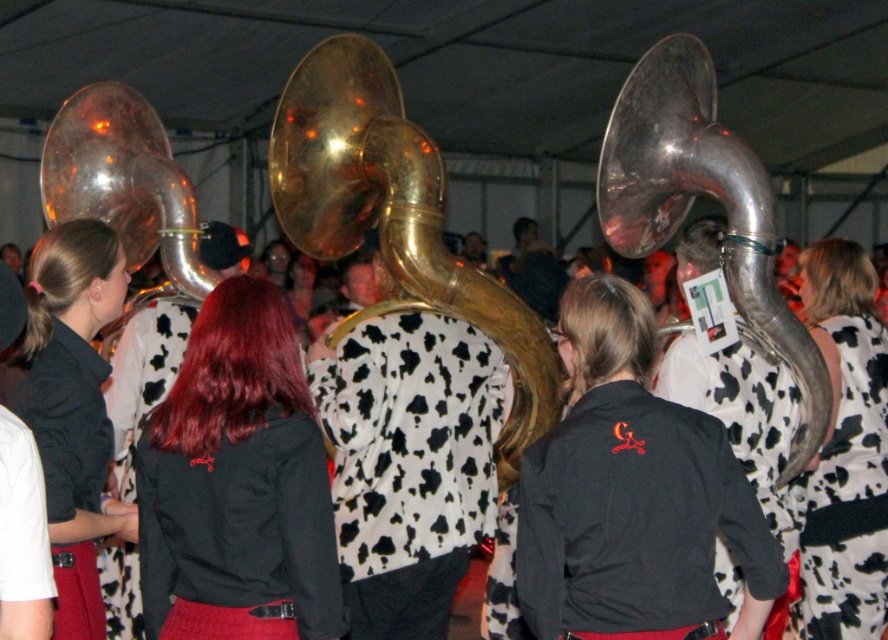
You are standing at the entrance of the tented event and want to locate the black fabric shirt at center. According to the coordinates provided, in which direction should you look relative to the center of the image?

The black fabric shirt at center is located at coordinates point 0.750 on the x axis and 0.268 on the y axis. Since the x value is greater than 0.5, it is to the right of center, and the y value is below 0.5, so it is below the center. Therefore, you should look to the lower right direction from the center of the image.

You are a photographer trying to capture a group photo of the performers. The black fabric shirt at center and the shiny brass tuba at left are both in your frame. Since you want to ensure both are clearly visible, which object should you focus on first considering their sizes?

→ The black fabric shirt at center is smaller than the shiny brass tuba at left, so you should focus on the shiny brass tuba at left first to ensure proper exposure and clarity, as larger objects often require more attention in composition.

You are a photographer at the event and want to take a photo that includes both the black fabric shirt at center and the matte black shirt at center. Which of these two shirts should you position closer to the camera to ensure both are fully visible in the frame?

The black fabric shirt at center is shorter than the matte black shirt at center, so positioning the black fabric shirt at center closer to the camera will ensure both are fully visible in the frame.